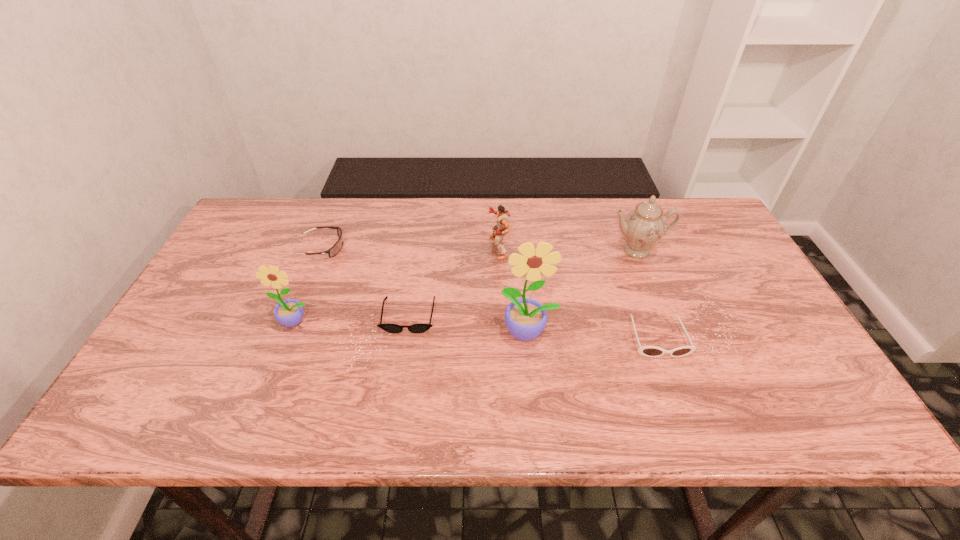
The width and height of the screenshot is (960, 540). In order to click on free region located 0.250m on the spout of the chinaware in this screenshot , I will do click(667, 330).

Image resolution: width=960 pixels, height=540 pixels. What are the coordinates of `free space located on the front-facing side of the fourth tallest object` in the screenshot? It's located at (457, 248).

You are a GUI agent. You are given a task and a screenshot of the screen. Output one action in this format:
    pyautogui.click(x=<x>, y=<y>)
    Task: Click on the free spot located on the front-facing side of the fourth tallest object
    This screenshot has height=540, width=960.
    Given the screenshot: What is the action you would take?
    click(x=434, y=248)

This screenshot has width=960, height=540. I want to click on vacant space located on the front-facing side of the fourth tallest object, so 450,248.

At what (x,y) coordinates should I click in order to perform the action: click on vacant area situated 0.150m on the lenses of the goggles. Please return your answer as a coordinate pair (x, y). The image size is (960, 540). Looking at the image, I should click on (395, 248).

Where is `vacant space situated on the front-facing side of the shorter sunglasses`? This screenshot has height=540, width=960. vacant space situated on the front-facing side of the shorter sunglasses is located at coordinates (399, 379).

Where is `chinaware that is positioned at the far edge`? chinaware that is positioned at the far edge is located at coordinates (644, 226).

Identify the location of puncher positioned at the far edge. (499, 231).

Where is `goggles that is at the far edge`? This screenshot has height=540, width=960. goggles that is at the far edge is located at coordinates (333, 251).

Locate an element on the screen. The width and height of the screenshot is (960, 540). object that is at the near edge is located at coordinates (649, 351).